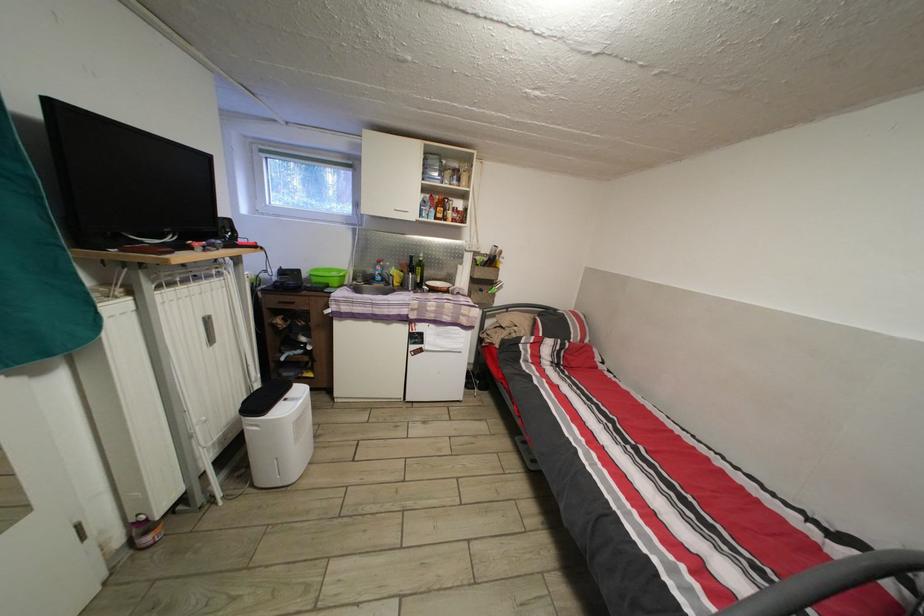
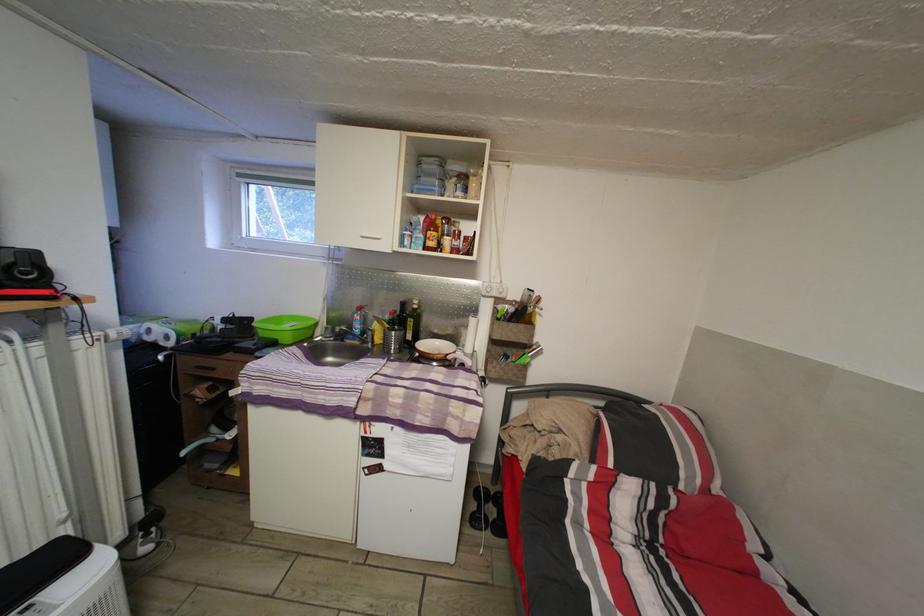
Find the pixel in the second image that matches point 426,276 in the first image.

(418, 329)